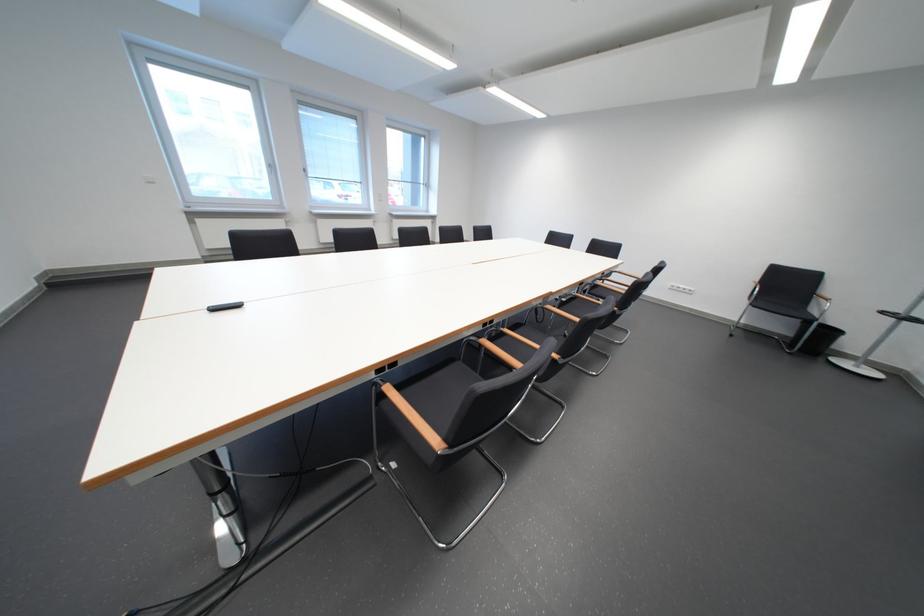
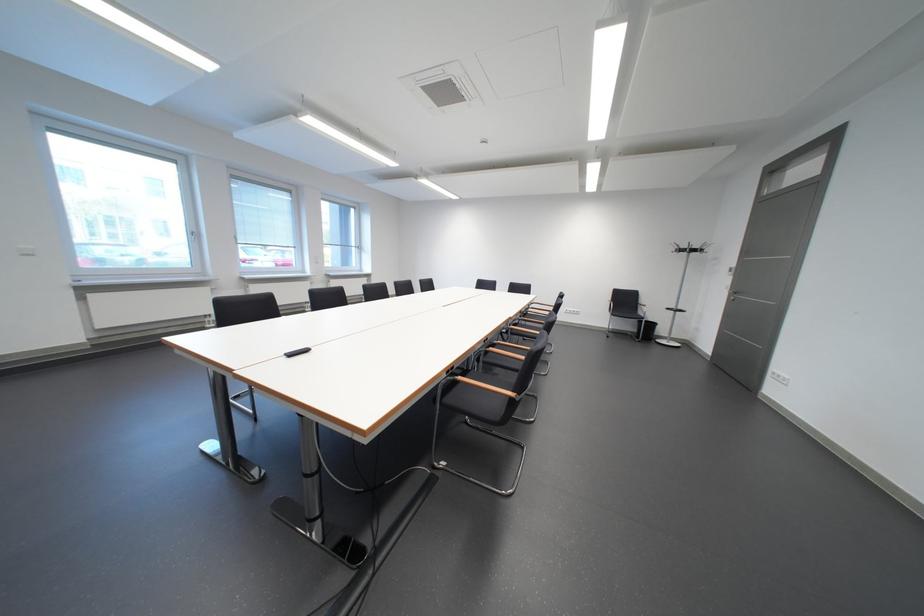
Where in the second image is the point corresponding to (x=789, y=326) from the first image?

(640, 328)